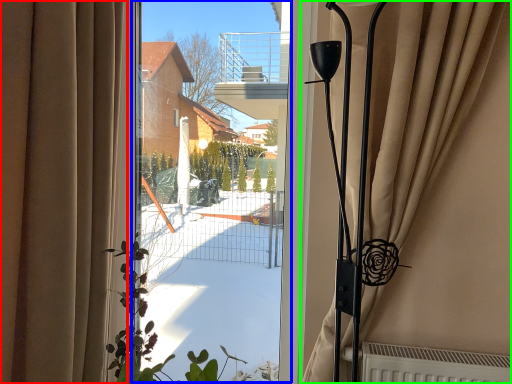
Question: Estimate the real-world distances between objects in this image. Which object is closer to curtain (highlighted by a red box), window screen (highlighted by a blue box) or curtain (highlighted by a green box)?

Choices:
 (A) window screen
 (B) curtain

Answer: (A)